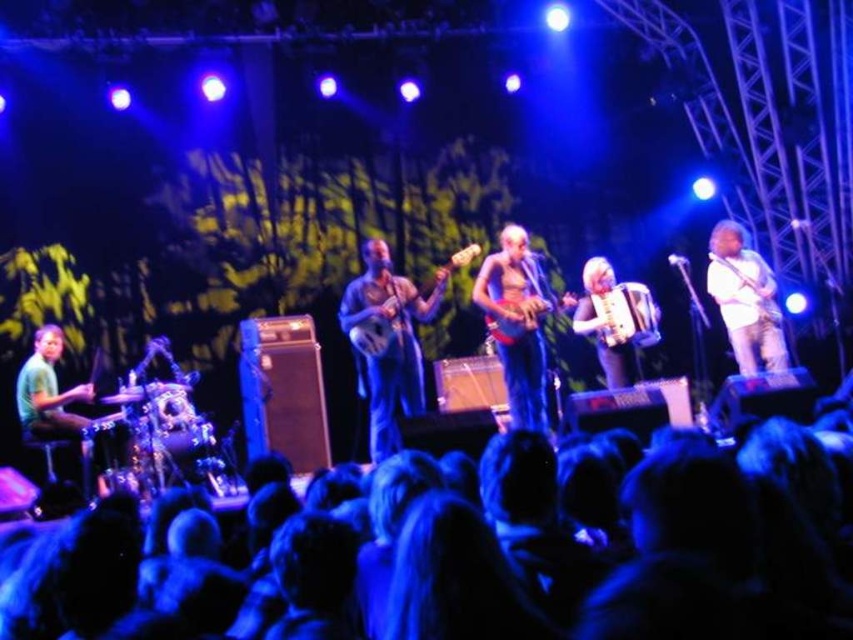
Looking at this image, you are a stagehand who needs to place a microphone stand exactly at the center of the stage. The stage has a coordinate system where the bottom left corner is point 0,0 and the top right corner is point 1,1. You see the shiny blue guitar at center. Where should you place the microphone stand to ensure it is at the center of the stage?

The center of the stage would be at point (426, 320). The shiny blue guitar at center is located at point (519, 328), which is slightly to the right and above the true center. Therefore, the microphone stand should be placed at point (426, 320) to be exactly at the center of the stage.

You are a photographer positioned at the center of the audience, aiming to capture the two points marked in the image. Which point, point (94, 390) or point (753, 266), will appear closer to you in the photo?

Point (753, 266) will appear closer to you because it is in front of point (94, 390).